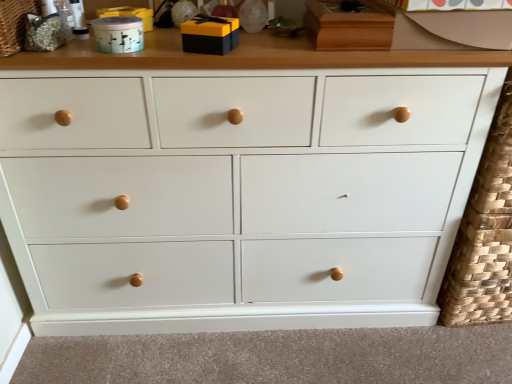
Question: From the image's perspective, is matte black gift box at upper center, acting as the second toy starting from the left, positioned above or below matte teal ceramic container at upper left, acting as the first toy starting from the left?

Choices:
 (A) above
 (B) below

Answer: (A)

Question: Is matte black gift box at upper center, acting as the second toy starting from the left, situated inside matte teal ceramic container at upper left, placed as the second toy when sorted from right to left, or outside?

Choices:
 (A) outside
 (B) inside

Answer: (A)

Question: Which of these objects is positioned farthest from the white painted wood chest of drawers at center?

Choices:
 (A) textured woven basket at upper left
 (B) matte black gift box at upper center, which appears as the 1th toy when viewed from the right
 (C) matte teal ceramic container at upper left, acting as the first toy starting from the left

Answer: (A)

Question: Estimate the real-world distances between objects in this image. Which object is farther from the white painted wood chest of drawers at center?

Choices:
 (A) textured woven basket at upper left
 (B) matte black gift box at upper center, which appears as the 1th toy when viewed from the right
 (C) matte teal ceramic container at upper left, placed as the second toy when sorted from right to left

Answer: (A)